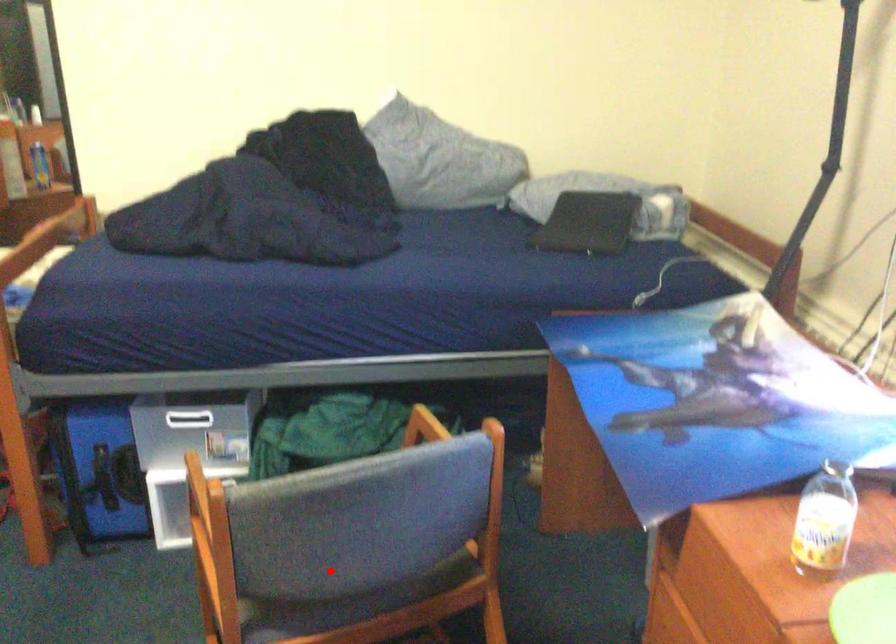
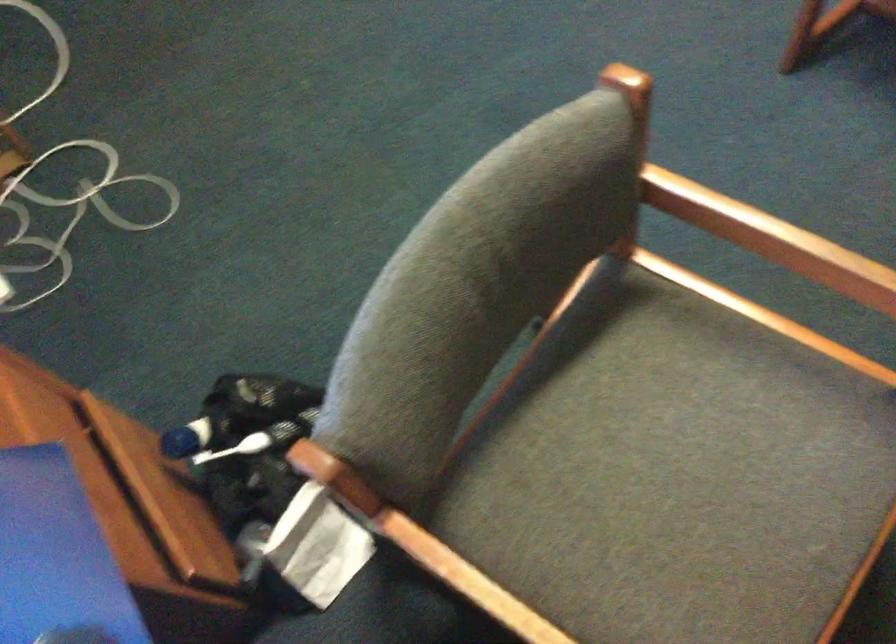
The point at the highlighted location is marked in the first image. Where is the corresponding point in the second image?

(643, 444)